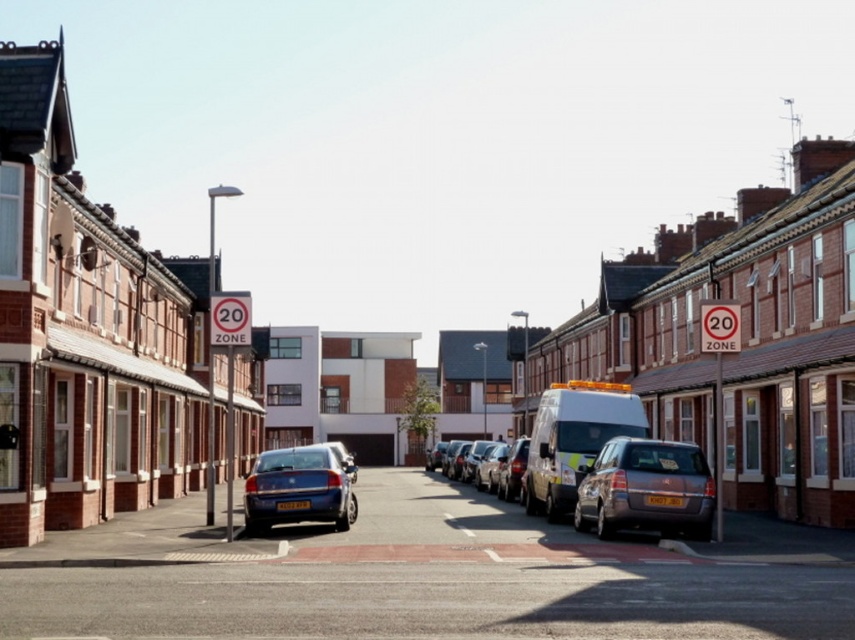
Question: Which object is the closest to the silver metallic van at center?

Choices:
 (A) metallic silver van at center
 (B) blue metallic car at center

Answer: (A)

Question: Can you confirm if silver metallic van at center is positioned to the right of metallic silver van at center?

Choices:
 (A) yes
 (B) no

Answer: (B)

Question: Is white glossy van at center further to the viewer compared to silver metallic van at center?

Choices:
 (A) no
 (B) yes

Answer: (A)

Question: Which of these objects is positioned farthest from the silver metallic van at center?

Choices:
 (A) white glossy van at center
 (B) shiny silver car at center
 (C) metallic silver van at center
 (D) shiny silver van at center

Answer: (A)

Question: Among these points, which one is nearest to the camera?

Choices:
 (A) (481, 486)
 (B) (703, 483)

Answer: (B)

Question: Is white glossy van at center thinner than shiny silver van at center?

Choices:
 (A) yes
 (B) no

Answer: (B)